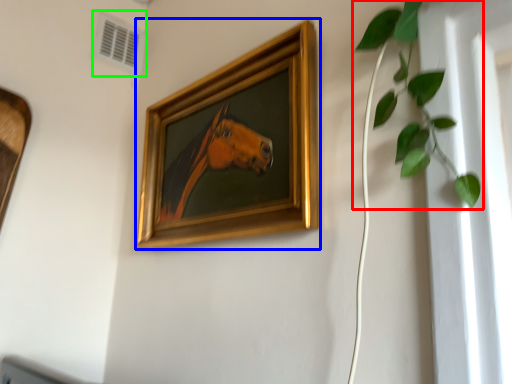
Question: Based on their relative distances, which object is farther from houseplant (highlighted by a red box)? Choose from picture frame (highlighted by a blue box) and air conditioning (highlighted by a green box).

Choices:
 (A) picture frame
 (B) air conditioning

Answer: (B)